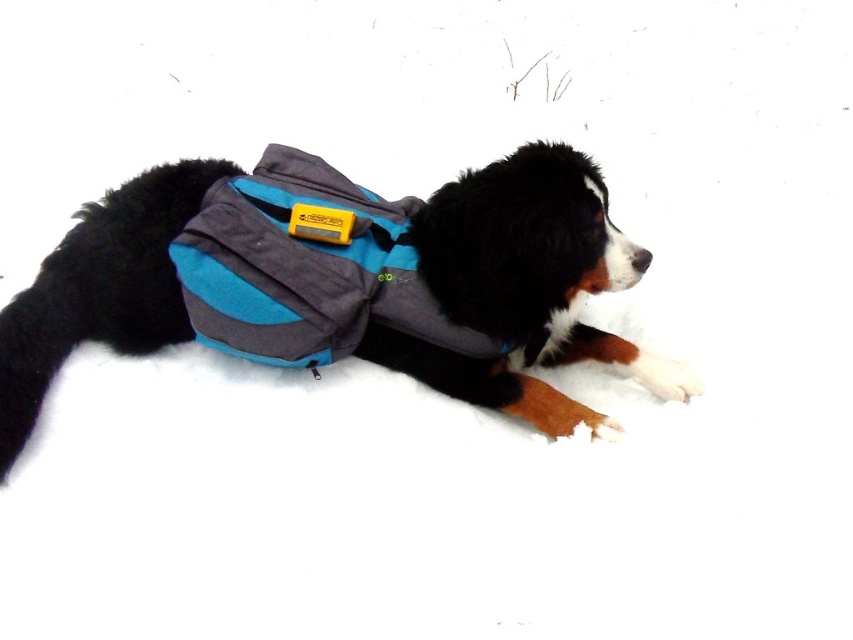
Can you confirm if soft gray fabric dog vest at center is thinner than teal fabric life jacket at center?

No, soft gray fabric dog vest at center is not thinner than teal fabric life jacket at center.

Is point (16, 429) behind point (312, 204)?

No, it is not.

Where is `soft gray fabric dog vest at center`? This screenshot has height=640, width=853. soft gray fabric dog vest at center is located at coordinates (524, 288).